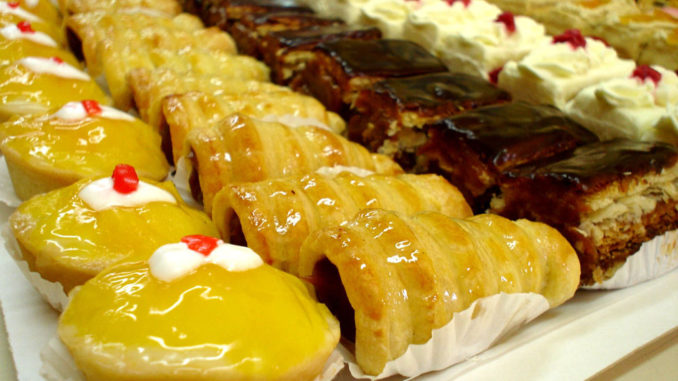
Find the location of a particular element. This screenshot has width=678, height=381. tabletop is located at coordinates (657, 361), (9, 365).